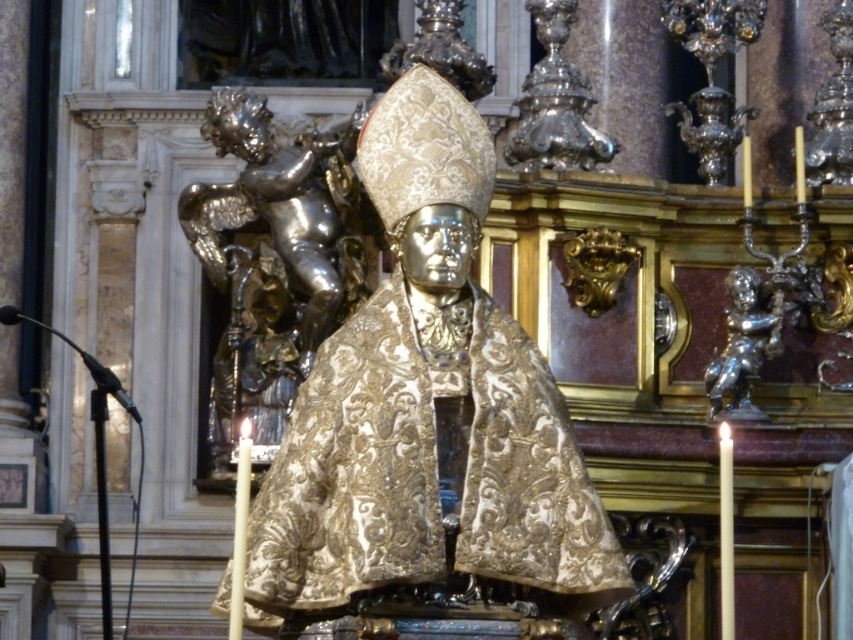
Can you confirm if gold embroidered cape at center is positioned below shiny silver cherub at right?

Incorrect, gold embroidered cape at center is not positioned below shiny silver cherub at right.

Is gold embroidered cape at center thinner than shiny silver cherub at right?

Incorrect, gold embroidered cape at center's width is not less than shiny silver cherub at right's.

Is point (491, 536) less distant than point (734, 406)?

Yes, it is.

What are the coordinates of `gold embroidered cape at center` in the screenshot? It's located at (426, 406).

Does gold embroidered cape at center have a smaller size compared to shiny silver cherub at left?

Actually, gold embroidered cape at center might be larger than shiny silver cherub at left.

Based on the photo, does gold embroidered cape at center appear on the left side of shiny silver cherub at left?

Incorrect, gold embroidered cape at center is not on the left side of shiny silver cherub at left.

Does point (408, 266) come farther from viewer compared to point (289, 266)?

No, (408, 266) is closer to viewer.

Identify the location of gold embroidered cape at center. Image resolution: width=853 pixels, height=640 pixels. (426, 406).

Does shiny silver cherub at left have a larger size compared to shiny silver cherub at right?

Yes.

Does point (311, 156) come in front of point (747, 273)?

No, (311, 156) is behind (747, 273).

Is point (352, 288) positioned in front of point (735, 397)?

No, (352, 288) is further to viewer.

In order to click on shiny silver cherub at left in this screenshot , I will do coord(283,209).